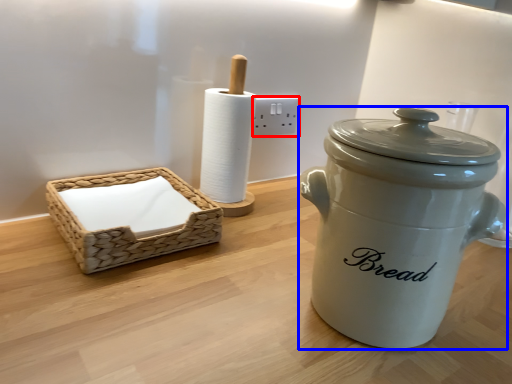
Question: Among these objects, which one is nearest to the camera, electric outlet (highlighted by a red box) or crock pot (highlighted by a blue box)?

Choices:
 (A) electric outlet
 (B) crock pot

Answer: (B)